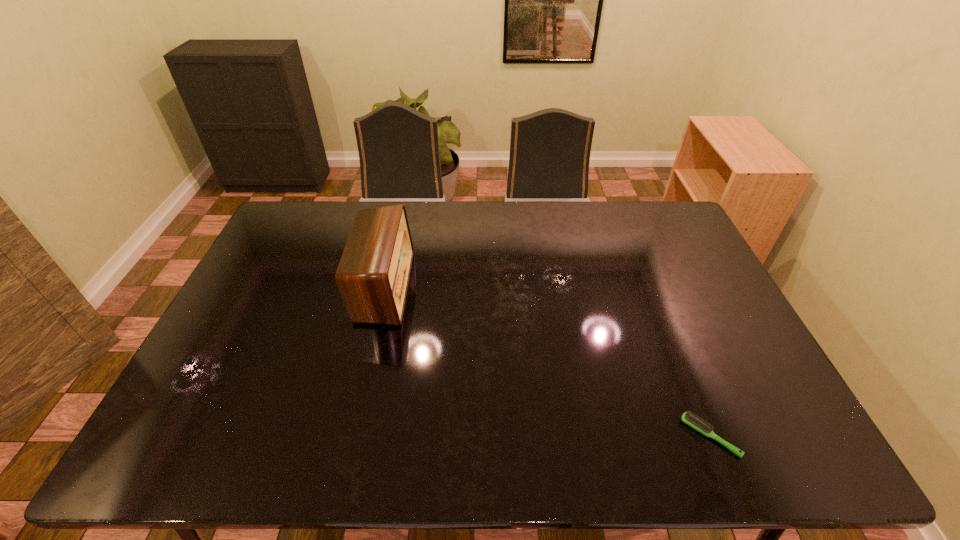
Where is `radio receiver`? radio receiver is located at coordinates (373, 274).

This screenshot has height=540, width=960. I want to click on the left object, so [373, 274].

The width and height of the screenshot is (960, 540). I want to click on the nearer object, so pos(689,419).

Where is `hairbrush`? The height and width of the screenshot is (540, 960). hairbrush is located at coordinates (689, 419).

Where is `vacant region located on the front-facing side of the radio receiver`? This screenshot has width=960, height=540. vacant region located on the front-facing side of the radio receiver is located at coordinates (469, 287).

Locate an element on the screen. The image size is (960, 540). free space located 0.140m on the back of the right object is located at coordinates (682, 366).

Where is `object that is at the near edge`? The width and height of the screenshot is (960, 540). object that is at the near edge is located at coordinates (689, 419).

Identify the location of object that is at the right edge. This screenshot has width=960, height=540. (689, 419).

The width and height of the screenshot is (960, 540). In order to click on object at the near right corner in this screenshot , I will do `click(689, 419)`.

In the image, there is a desktop. At what (x,y) coordinates should I click in order to perform the action: click on vacant area at the far edge. Please return your answer as a coordinate pair (x, y). Looking at the image, I should click on (592, 202).